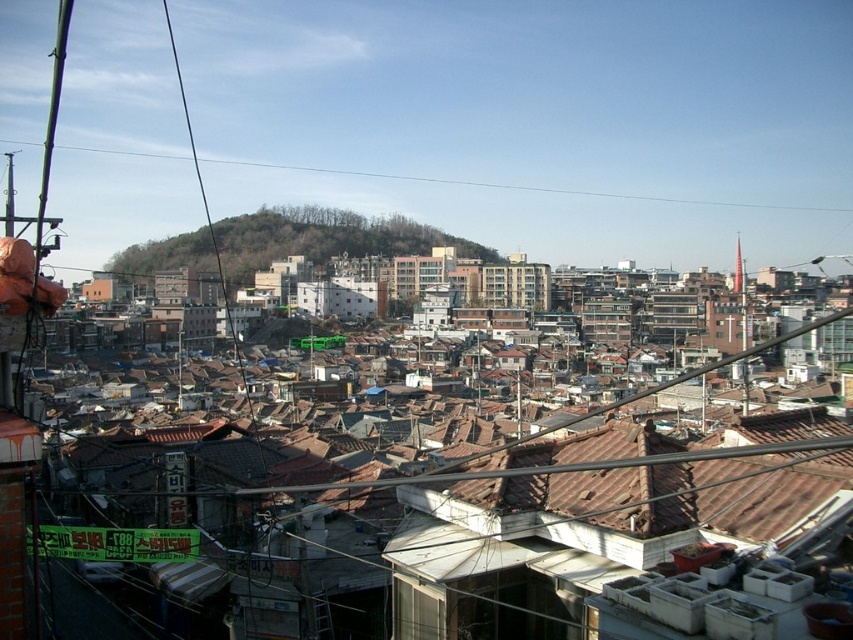
You are standing in the urban area shown and want to walk from point A to point B. Point A is at coordinate (380, 241) and point B is at coordinate (548, 189). Which direction should you move to get closer to point B?

To move from point A at (380, 241) to point B at (548, 189), you should move upward because point A is closer to the viewer than point B.

Based on the photo, you are a city planner analyzing this urban area. You need to install a new communication tower that must be at least 300 feet away from any existing power lines represented by the black wire at upper left. Is the green grassy hillside at center a suitable location for the tower? Please explain your reasoning based on the provided information.

The green grassy hillside at center is 266.75 feet away from the black wire at upper left. Since the required distance is 300 feet, the hillside is too close to the power lines. Therefore, it is not a suitable location for the tower.